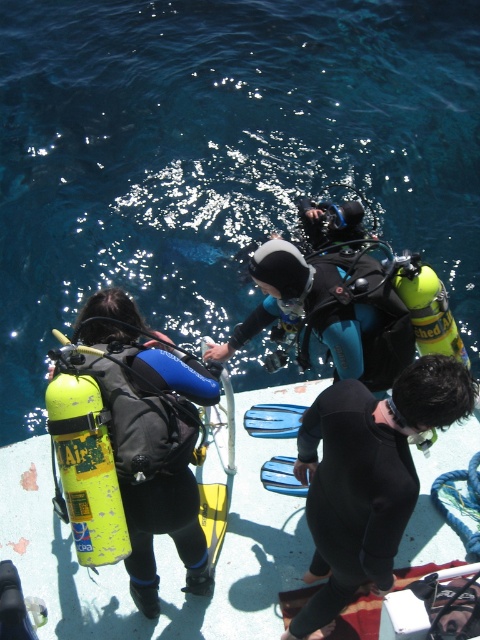
Is black matte wetsuit at center closer to camera compared to matte yellow scuba tank at left?

Yes, it is in front of matte yellow scuba tank at left.

Looking at this image, between black matte wetsuit at center and matte yellow scuba tank at left, which one is positioned lower?

black matte wetsuit at center is below.

Does point (368, 532) come in front of point (180, 369)?

That is True.

Identify the location of black matte wetsuit at center. (367, 477).

Is point (338, 92) positioned behind point (311, 282)?

Yes, it is.

From the picture: Which is more to the right, blue water at upper center or matte black wetsuit at center?

matte black wetsuit at center

Is point (179, 118) in front of point (374, 294)?

That is False.

Image resolution: width=480 pixels, height=640 pixels. Identify the location of blue water at upper center. (218, 154).

Does blue water at upper center have a greater height compared to black matte wetsuit at center?

Yes.

Which is more to the left, blue water at upper center or black matte wetsuit at center?

Positioned to the left is blue water at upper center.

Image resolution: width=480 pixels, height=640 pixels. I want to click on blue water at upper center, so click(218, 154).